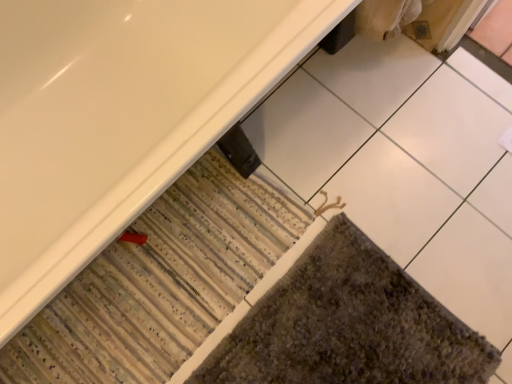
Question: Is textured gray bath mat at lower right, marked as the 1th bath mat in a right-to-left arrangement, not inside white glossy bathtub at lower left?

Choices:
 (A) yes
 (B) no

Answer: (A)

Question: Considering the relative positions of textured gray bath mat at lower right, marked as the 1th bath mat in a right-to-left arrangement, and white glossy bathtub at lower left in the image provided, is textured gray bath mat at lower right, marked as the 1th bath mat in a right-to-left arrangement, to the right of white glossy bathtub at lower left from the viewer's perspective?

Choices:
 (A) no
 (B) yes

Answer: (B)

Question: From a real-world perspective, is textured gray bath mat at lower right, arranged as the 2th bath mat when viewed from the left, under white glossy bathtub at lower left?

Choices:
 (A) yes
 (B) no

Answer: (A)

Question: Is textured gray bath mat at lower right, arranged as the 2th bath mat when viewed from the left, smaller than white glossy bathtub at lower left?

Choices:
 (A) no
 (B) yes

Answer: (B)

Question: Are textured gray bath mat at lower right, arranged as the 2th bath mat when viewed from the left, and white glossy bathtub at lower left beside each other?

Choices:
 (A) no
 (B) yes

Answer: (A)

Question: Is point (159, 201) closer or farther from the camera than point (324, 31)?

Choices:
 (A) farther
 (B) closer

Answer: (A)

Question: From a real-world perspective, is striped carpet at lower left, the second bath mat from the right, positioned above or below white glossy bathtub at lower left?

Choices:
 (A) above
 (B) below

Answer: (B)

Question: Considering the positions of striped carpet at lower left, the second bath mat from the right, and white glossy bathtub at lower left in the image, is striped carpet at lower left, the second bath mat from the right, wider or thinner than white glossy bathtub at lower left?

Choices:
 (A) thin
 (B) wide

Answer: (A)

Question: In the image, is striped carpet at lower left, the second bath mat from the right, positioned in front of or behind white glossy bathtub at lower left?

Choices:
 (A) front
 (B) behind

Answer: (B)

Question: In terms of size, does white glossy bathtub at lower left appear bigger or smaller than textured gray bath mat at lower right, marked as the 1th bath mat in a right-to-left arrangement?

Choices:
 (A) small
 (B) big

Answer: (B)

Question: From a real-world perspective, is white glossy bathtub at lower left physically located above or below textured gray bath mat at lower right, arranged as the 2th bath mat when viewed from the left?

Choices:
 (A) above
 (B) below

Answer: (A)

Question: Is white glossy bathtub at lower left to the left or to the right of textured gray bath mat at lower right, arranged as the 2th bath mat when viewed from the left, in the image?

Choices:
 (A) right
 (B) left

Answer: (B)

Question: Looking at their shapes, would you say white glossy bathtub at lower left is wider or thinner than textured gray bath mat at lower right, marked as the 1th bath mat in a right-to-left arrangement?

Choices:
 (A) thin
 (B) wide

Answer: (B)

Question: In terms of width, does textured gray bath mat at lower right, marked as the 1th bath mat in a right-to-left arrangement, look wider or thinner when compared to striped carpet at lower left, which appears as the 1th bath mat when viewed from the left?

Choices:
 (A) wide
 (B) thin

Answer: (A)

Question: Is textured gray bath mat at lower right, arranged as the 2th bath mat when viewed from the left, inside the boundaries of striped carpet at lower left, the second bath mat from the right, or outside?

Choices:
 (A) inside
 (B) outside

Answer: (B)